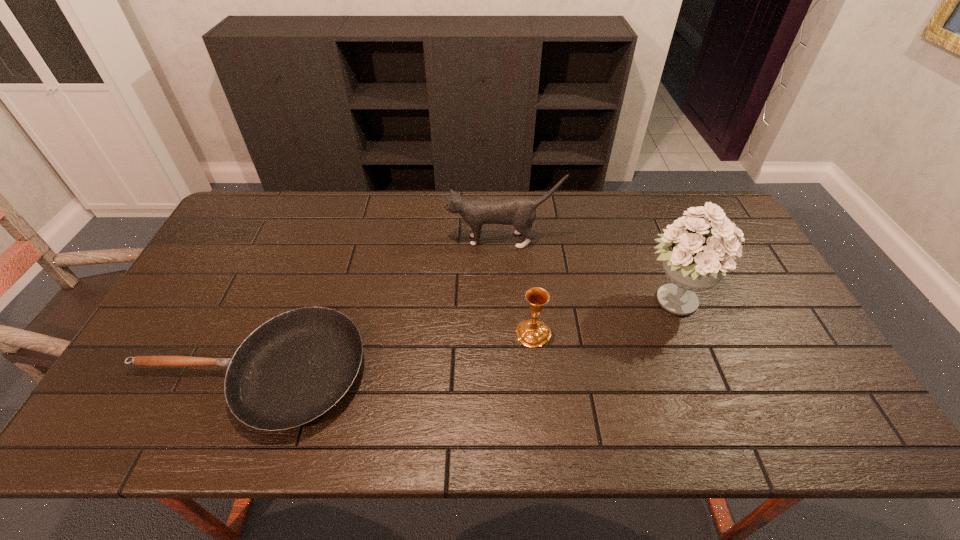
This screenshot has height=540, width=960. Find the location of `the rightmost object`. the rightmost object is located at coordinates (695, 257).

You are a GUI agent. You are given a task and a screenshot of the screen. Output one action in this format:
    pyautogui.click(x=<x>, y=<y>)
    Task: Click on the bouquet
    The width and height of the screenshot is (960, 540).
    Given the screenshot: What is the action you would take?
    pyautogui.click(x=695, y=257)

At what (x,y) coordinates should I click in order to perform the action: click on cat. Please return your answer as a coordinate pair (x, y). This screenshot has height=540, width=960. Looking at the image, I should click on (521, 212).

Locate an element on the screen. This screenshot has height=540, width=960. the farthest object is located at coordinates (521, 212).

The height and width of the screenshot is (540, 960). Find the location of `chalice`. chalice is located at coordinates (532, 333).

You are a GUI agent. You are given a task and a screenshot of the screen. Output one action in this format:
    pyautogui.click(x=<x>, y=<y>)
    Task: Click on the shortest object
    The width and height of the screenshot is (960, 540).
    Given the screenshot: What is the action you would take?
    pyautogui.click(x=294, y=368)

Identify the location of frying pan. (294, 368).

At what (x,y) coordinates should I click in order to perform the action: click on vacant space situated on the front of the bouquet. Please return your answer as a coordinate pair (x, y). Looking at the image, I should click on (691, 348).

The height and width of the screenshot is (540, 960). Find the location of `vacant space situated 0.130m at the face of the farthest object`. vacant space situated 0.130m at the face of the farthest object is located at coordinates (406, 240).

Image resolution: width=960 pixels, height=540 pixels. I want to click on vacant space located 0.070m at the face of the farthest object, so tap(425, 240).